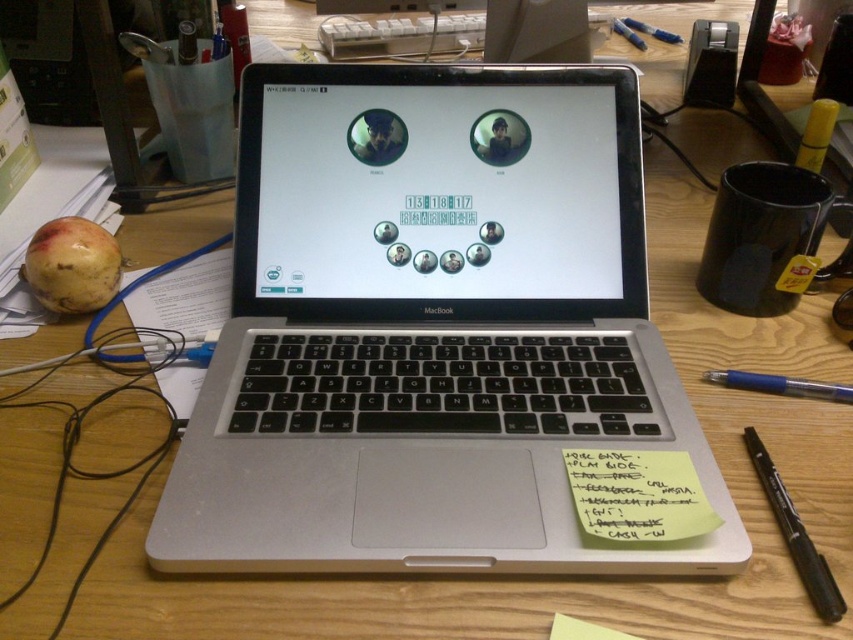
Question: Which of the following is the farthest from the observer?

Choices:
 (A) (793, 561)
 (B) (816, 388)

Answer: (B)

Question: Observing the image, what is the correct spatial positioning of yellow paper at lower right in reference to blue plastic pen at lower right?

Choices:
 (A) right
 (B) left

Answer: (B)

Question: Which is nearer to the ripe yellow apple at left?

Choices:
 (A) blue plastic pen at lower right
 (B) black plastic pen at lower right

Answer: (A)

Question: Is ripe yellow apple at left above black plastic pen at lower right?

Choices:
 (A) yes
 (B) no

Answer: (A)

Question: Can you confirm if ripe yellow apple at left is positioned above blue plastic pen at lower right?

Choices:
 (A) no
 (B) yes

Answer: (B)

Question: Which object is farther from the camera taking this photo?

Choices:
 (A) yellow paper at lower right
 (B) ripe yellow apple at left
 (C) blue plastic pen at lower right
 (D) silver metallic laptop at center

Answer: (B)